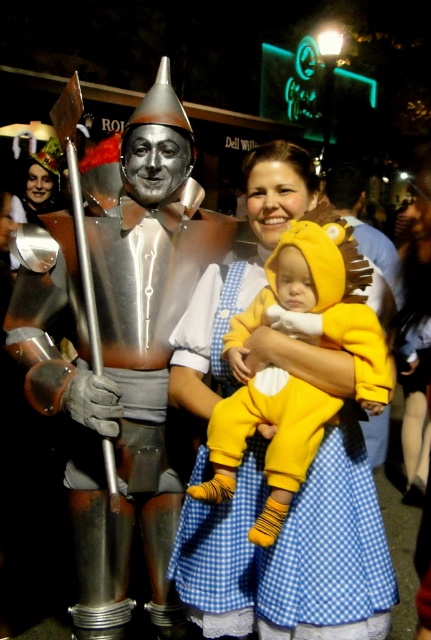
Is shiny silver armor at center thinner than soft yellow plush at center?

No.

Between shiny silver armor at center and soft yellow plush at center, which one appears on the left side from the viewer's perspective?

Positioned to the left is shiny silver armor at center.

Find the location of `shiny silver armor at center`. shiny silver armor at center is located at coordinates coord(118,355).

You are a GUI agent. You are given a task and a screenshot of the screen. Output one action in this format:
    pyautogui.click(x=<x>, y=<y>)
    Task: Click on the shiny silver armor at center
    The width and height of the screenshot is (431, 640).
    Given the screenshot: What is the action you would take?
    (x=118, y=355)